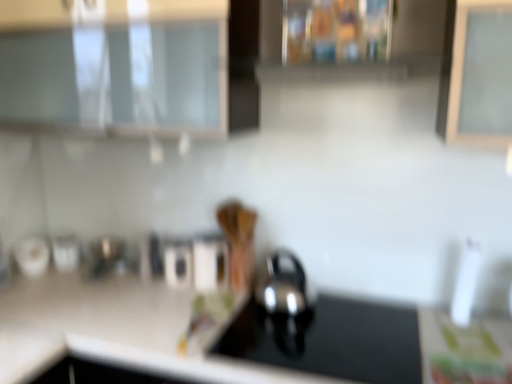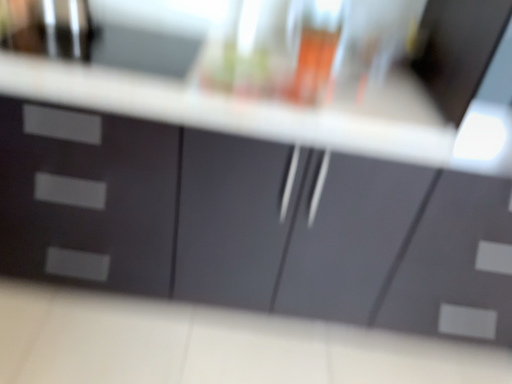
Question: How did the camera likely rotate when shooting the video?

Choices:
 (A) rotated downward
 (B) rotated upward

Answer: (A)